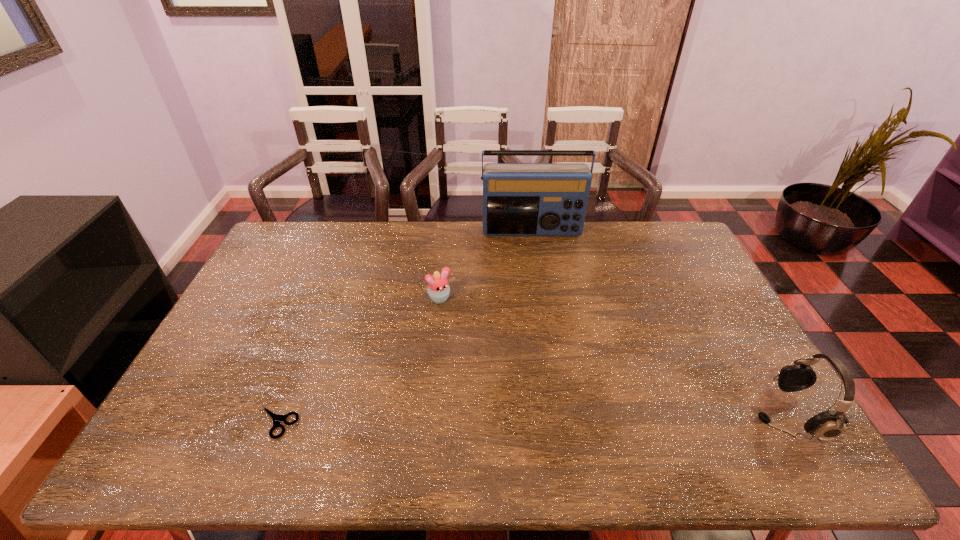
Locate an element on the screen. This screenshot has width=960, height=540. vacant area between the leftmost object and the radio receiver is located at coordinates (404, 327).

The image size is (960, 540). Find the location of `vacant region between the radio receiver and the third nearest object`. vacant region between the radio receiver and the third nearest object is located at coordinates (487, 265).

Find the location of `free space between the rightmost object and the shortest object`. free space between the rightmost object and the shortest object is located at coordinates (531, 418).

I want to click on free spot between the rightmost object and the third nearest object, so click(x=613, y=356).

This screenshot has width=960, height=540. Find the location of `vacant region between the third nearest object and the shortest object`. vacant region between the third nearest object and the shortest object is located at coordinates (359, 360).

Identify the location of vacant area between the leftmost object and the rightmost object. This screenshot has height=540, width=960. point(531,418).

Find the location of `vacant space in between the rightmost object and the farthest object`. vacant space in between the rightmost object and the farthest object is located at coordinates (659, 323).

Find the location of a particular element. unoccupied position between the shortest object and the third object from left to right is located at coordinates (404, 327).

Locate an element on the screen. free spot between the cupcake and the shortest object is located at coordinates (359, 360).

Locate which object is the second closest to the second tallest object. Please provide its 2D coordinates. Your answer should be formatted as a tuple, i.e. [(x, y)], where the tuple contains the x and y coordinates of a point satisfying the conditions above.

[(438, 287)]